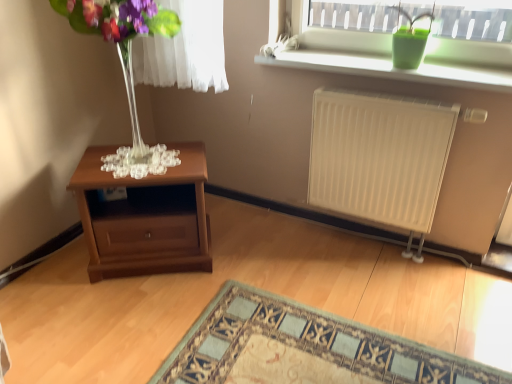
Question: In terms of size, does mahogany wood nightstand at lower left appear bigger or smaller than transparent glass vase at left?

Choices:
 (A) small
 (B) big

Answer: (B)

Question: From the image's perspective, is mahogany wood nightstand at lower left located above or below transparent glass vase at left?

Choices:
 (A) below
 (B) above

Answer: (A)

Question: Estimate the real-world distances between objects in this image. Which object is closer to the mahogany wood nightstand at lower left?

Choices:
 (A) green matte vase at upper right
 (B) transparent glass vase at left
 (C) white matte radiator at right
 (D) carpet with intricate pattern at lower center
 (E) green matte pot at upper right

Answer: (D)

Question: Which object is positioned farthest from the green matte pot at upper right?

Choices:
 (A) carpet with intricate pattern at lower center
 (B) white matte radiator at right
 (C) transparent glass vase at left
 (D) mahogany wood nightstand at lower left
 (E) green matte vase at upper right

Answer: (D)